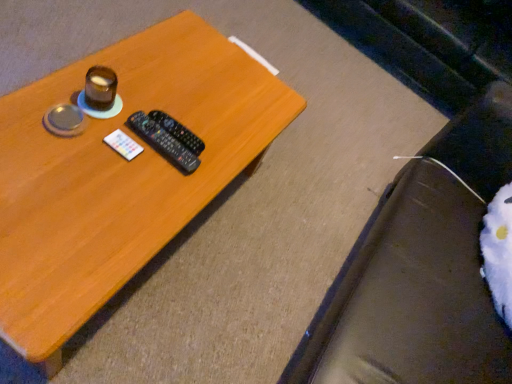
Identify the location of free location to the right of wooden table at center. This screenshot has width=512, height=384. (243, 269).